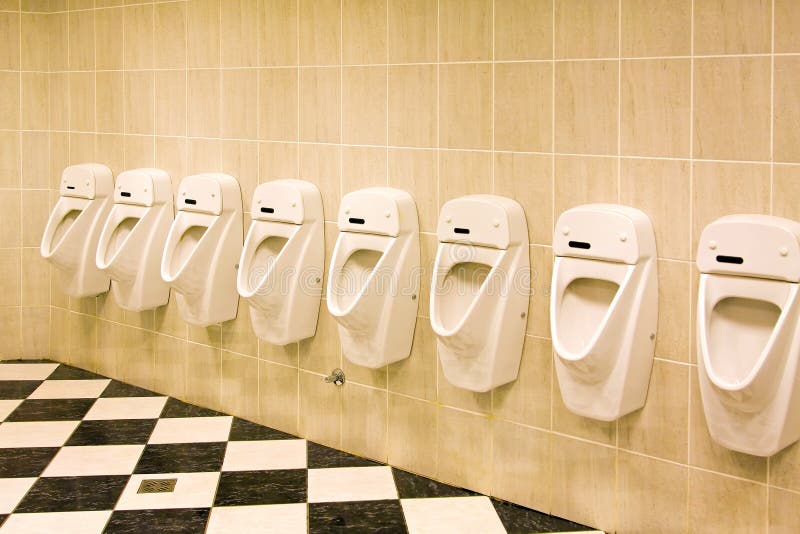
Identify the location of urinals. The width and height of the screenshot is (800, 534). (61, 223), (106, 241), (198, 247), (309, 261), (398, 272), (505, 292), (604, 307), (762, 324).